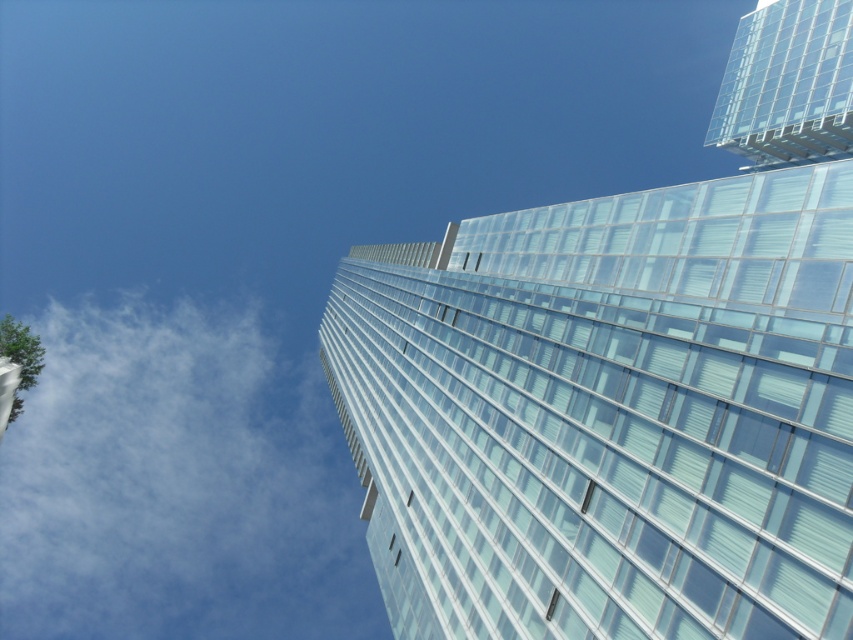
Question: Which point is closer to the camera?

Choices:
 (A) (4, 563)
 (B) (473, 259)

Answer: (B)

Question: Is transparent glass building at upper center positioned behind white fluffy cloud at upper left?

Choices:
 (A) no
 (B) yes

Answer: (A)

Question: Among these objects, which one is farthest from the camera?

Choices:
 (A) transparent glass building at upper center
 (B) transparent glass building at upper right
 (C) white fluffy cloud at upper left

Answer: (C)

Question: Does white fluffy cloud at upper left appear under transparent glass building at upper right?

Choices:
 (A) yes
 (B) no

Answer: (A)

Question: Is white fluffy cloud at upper left below transparent glass building at upper right?

Choices:
 (A) yes
 (B) no

Answer: (A)

Question: Among these points, which one is nearest to the camera?

Choices:
 (A) (415, 353)
 (B) (111, 595)
 (C) (824, 83)

Answer: (C)